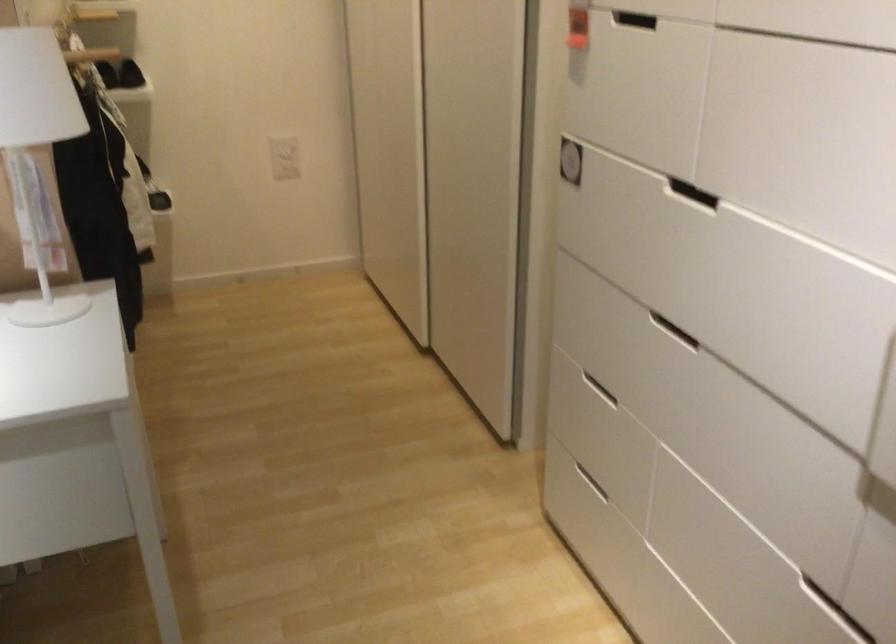
What do you see at coordinates (576, 24) in the screenshot? This screenshot has height=644, width=896. I see `the red paper tag` at bounding box center [576, 24].